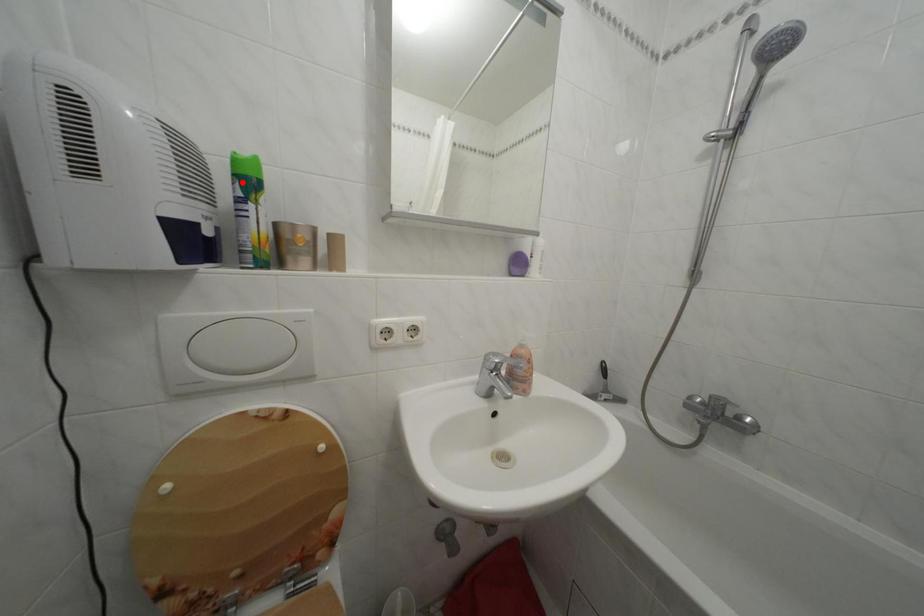
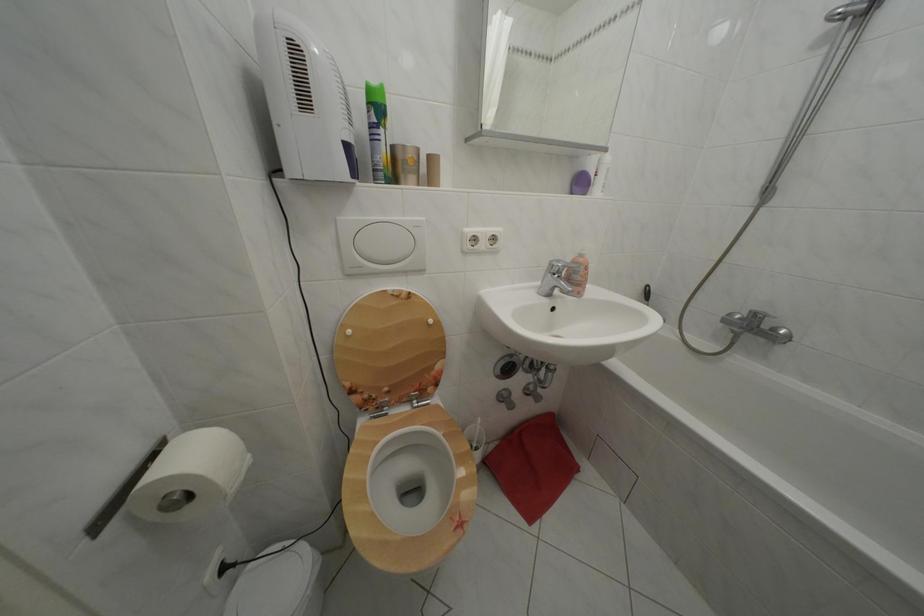
Where in the second image is the point corresponding to the highlighted location from the first image?

(378, 110)